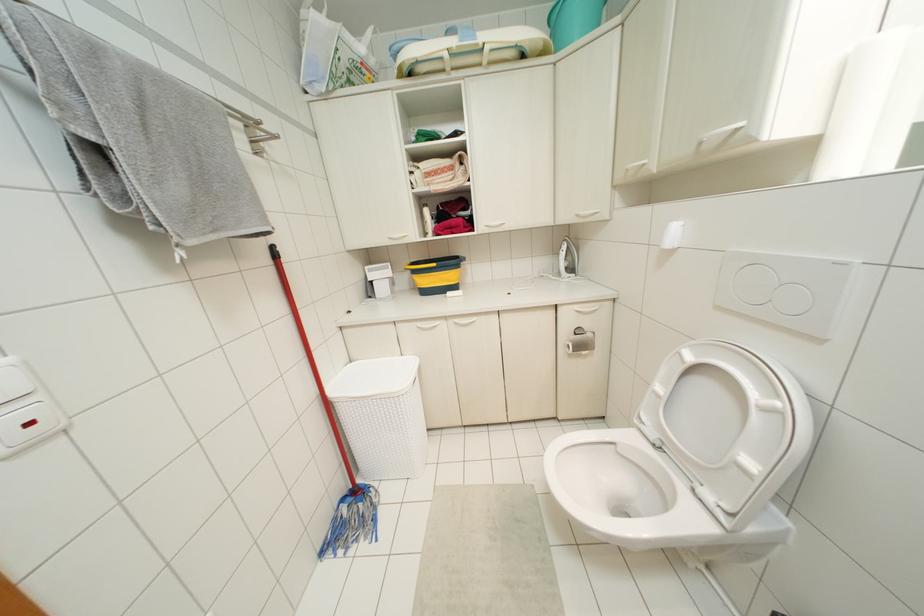
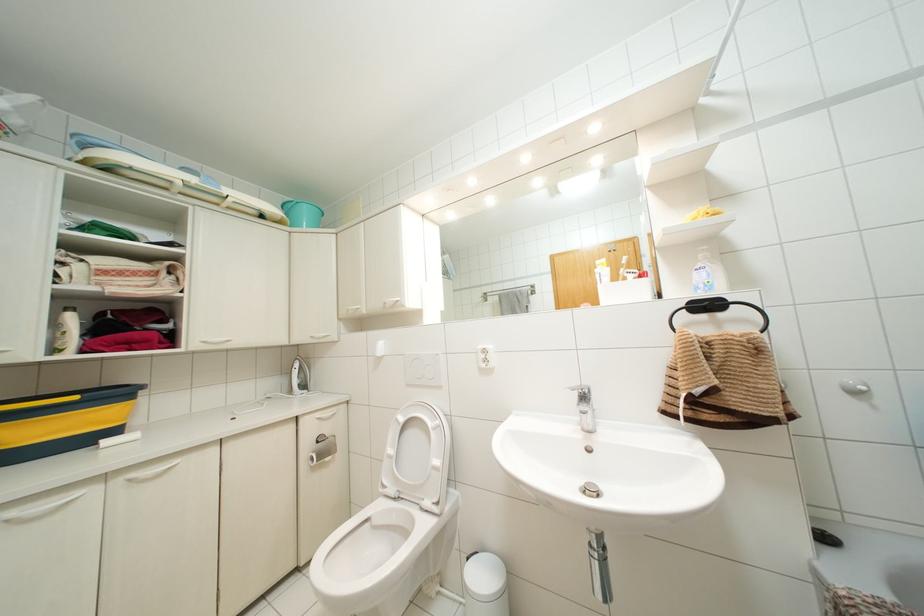
Where in the second image is the point corresponding to pixel 582 352 from the first image?

(326, 459)